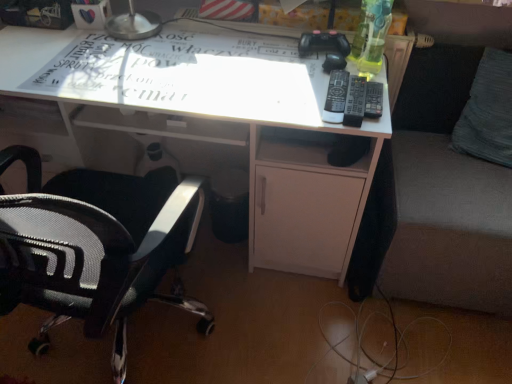
Identify the location of free area behind black plastic remote at right, the second remote when ordered from right to left. (319, 70).